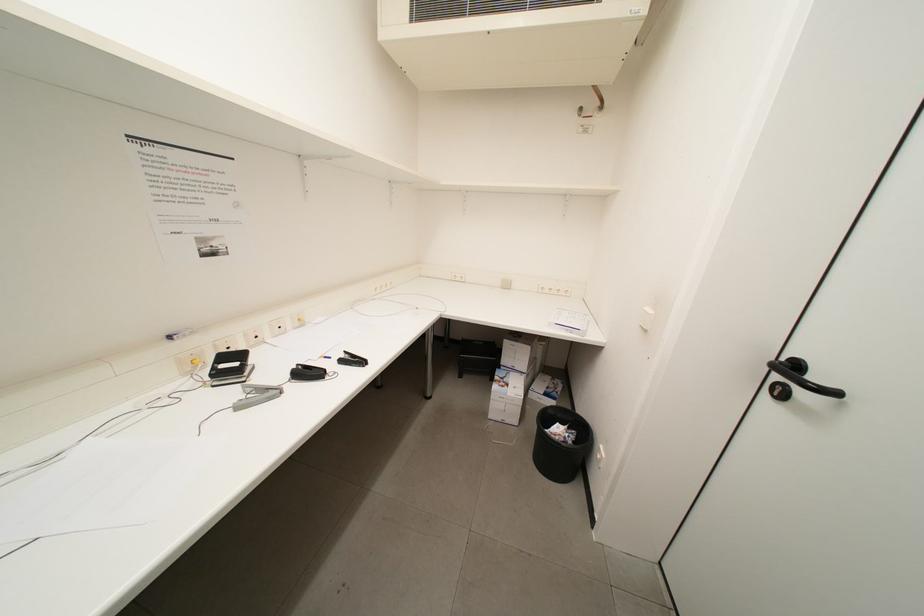
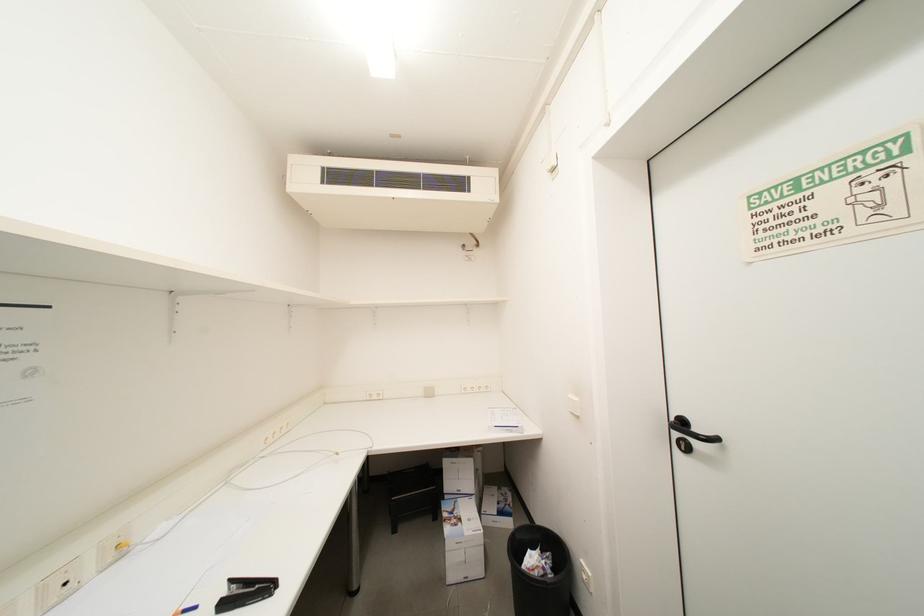
Based on the continuous images, in which direction is the camera rotating?

The rotation direction of the camera is right-up.